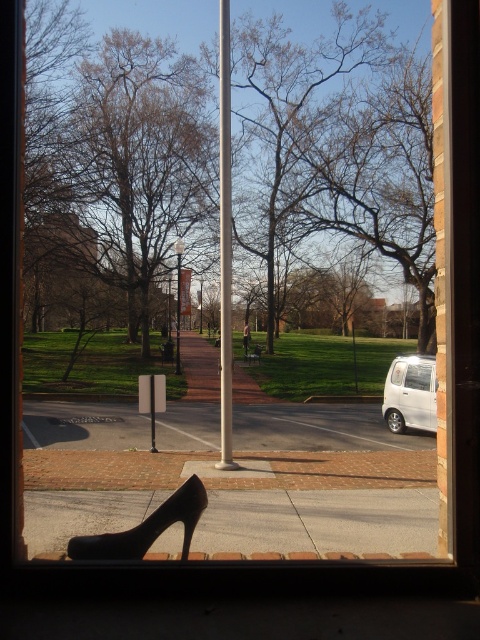
You are a photographer trying to capture a clear shot of the smooth silver pole at center and the black leather high heel at lower left. Since the high heel is slightly out of focus, how does its size in the photo compare to the pole?

The smooth silver pole at center is bigger than the black leather high heel at lower left, so the pole will appear larger in the photo.

You are a photographer standing at the window. You want to take a photo that includes both the smooth silver pole at center and the black leather high heel at lower left. Which object should you focus on to ensure both are in the frame?

The smooth silver pole at center is much taller than the black leather high heel at lower left, so focusing on the pole will ensure both are in the frame.